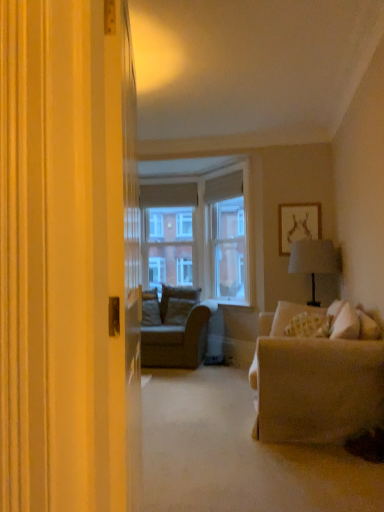
Question: Could you tell me if patterned fabric pillow at right, positioned as the first pillow in front-to-back order, is turned towards clear glass window screen at center, positioned as the second window screen in right-to-left order?

Choices:
 (A) no
 (B) yes

Answer: (A)

Question: Is patterned fabric pillow at right, marked as the 1th pillow in a right-to-left arrangement, further to the viewer compared to clear glass window screen at center, the second window screen viewed from the front?

Choices:
 (A) yes
 (B) no

Answer: (B)

Question: Considering the relative sizes of patterned fabric pillow at right, marked as the 1th pillow in a right-to-left arrangement, and clear glass window screen at center, which is the first window screen from left to right, in the image provided, is patterned fabric pillow at right, marked as the 1th pillow in a right-to-left arrangement, taller than clear glass window screen at center, which is the first window screen from left to right,?

Choices:
 (A) yes
 (B) no

Answer: (B)

Question: Does patterned fabric pillow at right, marked as the 1th pillow in a right-to-left arrangement, appear on the right side of clear glass window screen at center, positioned as the second window screen in right-to-left order?

Choices:
 (A) yes
 (B) no

Answer: (A)

Question: Is patterned fabric pillow at right, marked as the 1th pillow in a right-to-left arrangement, outside of clear glass window screen at center, positioned as the second window screen in right-to-left order?

Choices:
 (A) no
 (B) yes

Answer: (B)

Question: Which is correct: suede cushion at center, which is counted as the 2th pillow, starting from the front, is inside clear glass window screen at center, the second window screen viewed from the front, or outside of it?

Choices:
 (A) inside
 (B) outside

Answer: (B)

Question: Based on their sizes in the image, would you say suede cushion at center, which is counted as the 2th pillow, starting from the front, is bigger or smaller than clear glass window screen at center, positioned as the second window screen in right-to-left order?

Choices:
 (A) big
 (B) small

Answer: (B)

Question: Is point (188, 293) positioned closer to the camera than point (147, 231)?

Choices:
 (A) farther
 (B) closer

Answer: (B)

Question: From the image's perspective, is suede cushion at center, which is counted as the 2th pillow, starting from the front, positioned above or below clear glass window screen at center, which is the first window screen from left to right?

Choices:
 (A) below
 (B) above

Answer: (A)

Question: Relative to patterned fabric pillow at right, marked as the 1th pillow in a right-to-left arrangement, is suede cushion at center, which is counted as the 2th pillow, starting from the front, in front or behind?

Choices:
 (A) behind
 (B) front

Answer: (A)

Question: From their relative heights in the image, would you say suede cushion at center, marked as the 2th pillow in a right-to-left arrangement, is taller or shorter than patterned fabric pillow at right, the second pillow viewed from the left?

Choices:
 (A) short
 (B) tall

Answer: (B)

Question: From a real-world perspective, is suede cushion at center, which is counted as the 2th pillow, starting from the front, physically located above or below patterned fabric pillow at right, positioned as the first pillow in front-to-back order?

Choices:
 (A) above
 (B) below

Answer: (A)

Question: Is point (168, 313) positioned closer to the camera than point (271, 331)?

Choices:
 (A) farther
 (B) closer

Answer: (A)

Question: In terms of height, does textured beige couch at center look taller or shorter compared to clear glass window screen at center, the first window screen from the right?

Choices:
 (A) tall
 (B) short

Answer: (B)

Question: From a real-world perspective, is textured beige couch at center physically located above or below clear glass window screen at center, acting as the second window screen starting from the left?

Choices:
 (A) below
 (B) above

Answer: (A)